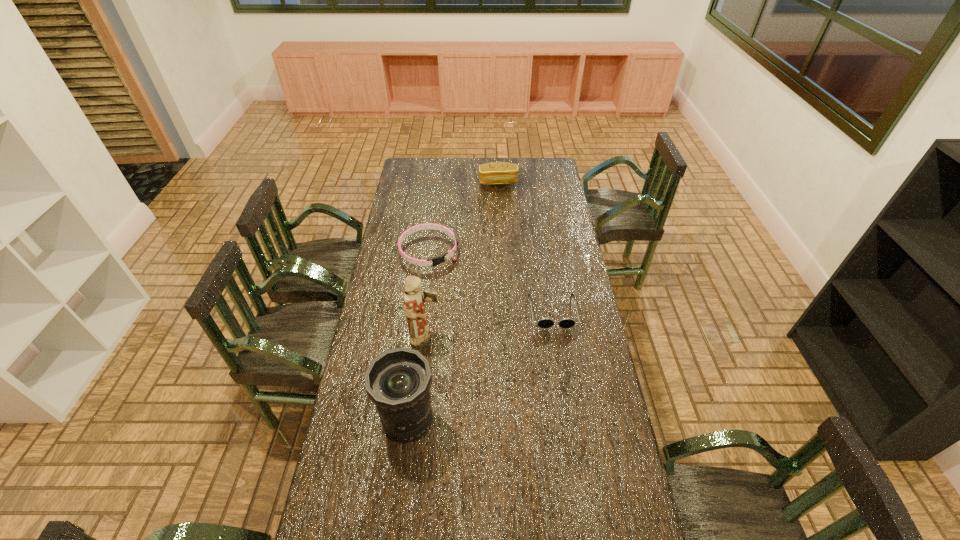
You are a GUI agent. You are given a task and a screenshot of the screen. Output one action in this format:
    pyautogui.click(x=<x>, y=<y>)
    Task: Click on the free space between the farthest object and the nearest object
    This screenshot has height=540, width=960.
    Given the screenshot: What is the action you would take?
    pyautogui.click(x=453, y=301)

At what (x,y) coordinates should I click in order to perform the action: click on empty location between the sunglasses and the dog collar. Please return your answer as a coordinate pair (x, y). This screenshot has width=960, height=540. Looking at the image, I should click on (491, 281).

At what (x,y) coordinates should I click in order to perform the action: click on free space that is in between the fourth nearest object and the clutch bag. Please return your answer as a coordinate pair (x, y). The height and width of the screenshot is (540, 960). Looking at the image, I should click on (464, 217).

Point out which object is positioned as the fourth nearest to the third tallest object. Please provide its 2D coordinates. Your answer should be formatted as a tuple, i.e. [(x, y)], where the tuple contains the x and y coordinates of a point satisfying the conditions above.

[(398, 381)]

Where is `object that ranks as the fourth closest to the figurine`? object that ranks as the fourth closest to the figurine is located at coordinates (496, 173).

Where is `blank area in the image that satisfies the following two spatial constraints: 1. on the back side of the dog collar; 2. on the right side of the farthest object`? This screenshot has height=540, width=960. blank area in the image that satisfies the following two spatial constraints: 1. on the back side of the dog collar; 2. on the right side of the farthest object is located at coordinates (438, 182).

What are the coordinates of `vacant area in the image that satisfies the following two spatial constraints: 1. on the front side of the dog collar; 2. on the left side of the tallest object` in the screenshot? It's located at (419, 339).